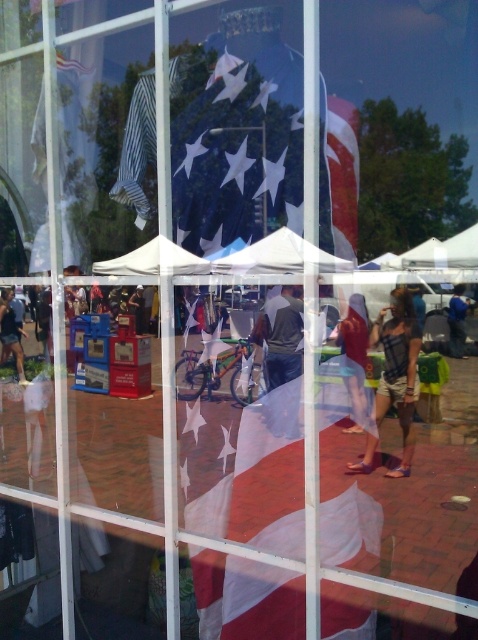
Which is above, red fabric flag at center or dark gray backpack at center?

Positioned higher is red fabric flag at center.

Between point (344, 116) and point (254, 324), which one is positioned in front?

Point (344, 116)

What are the coordinates of `red fabric flag at center` in the screenshot? It's located at (343, 173).

Can you confirm if red fabric flag at center is bigger than blue denim shorts at center?

Actually, red fabric flag at center might be smaller than blue denim shorts at center.

Is point (330, 124) positioned in front of point (449, 316)?

That is True.

This screenshot has height=640, width=478. In order to click on red fabric flag at center in this screenshot , I will do `click(343, 173)`.

Who is more forward, (262, 332) or (12, 326)?

Point (262, 332) is in front.

Where is `dark gray backpack at center`? This screenshot has width=478, height=640. dark gray backpack at center is located at coordinates (269, 317).

Locate an element on the screen. This screenshot has height=640, width=478. dark gray backpack at center is located at coordinates (269, 317).